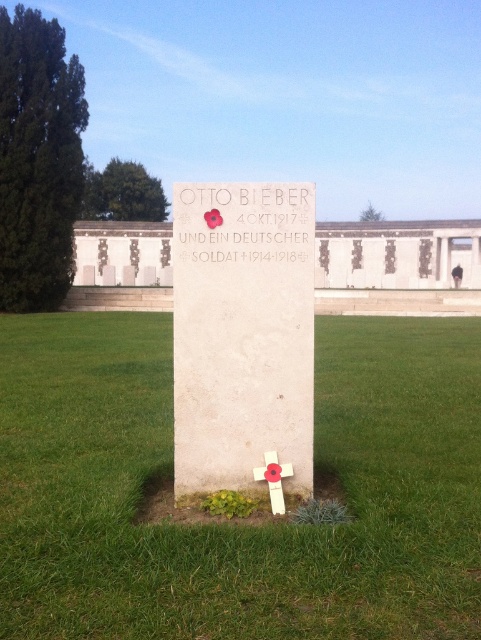
Locate an element on the screen. The width and height of the screenshot is (481, 640). white marble cross at center is located at coordinates (243, 339).

Is white marble cross at center shorter than red poppy at center?

No.

Does point (189, 468) come behind point (266, 481)?

Yes, point (189, 468) is farther from viewer.

Locate an element on the screen. The image size is (481, 640). white marble cross at center is located at coordinates (243, 339).

Is green grass at center taller than white marble cross at center?

No.

Does green grass at center lie in front of white marble cross at center?

Yes, green grass at center is closer to the viewer.

Who is more forward, (151, 428) or (209, 476)?

Point (209, 476) is more forward.

I want to click on green grass at center, so click(x=229, y=524).

Between green grass at center and red poppy at center, which one has more height?

Standing taller between the two is green grass at center.

Is green grass at center below red poppy at center?

No, green grass at center is not below red poppy at center.

The width and height of the screenshot is (481, 640). What do you see at coordinates (229, 524) in the screenshot? I see `green grass at center` at bounding box center [229, 524].

Where is `green grass at center`? The height and width of the screenshot is (640, 481). green grass at center is located at coordinates (229, 524).